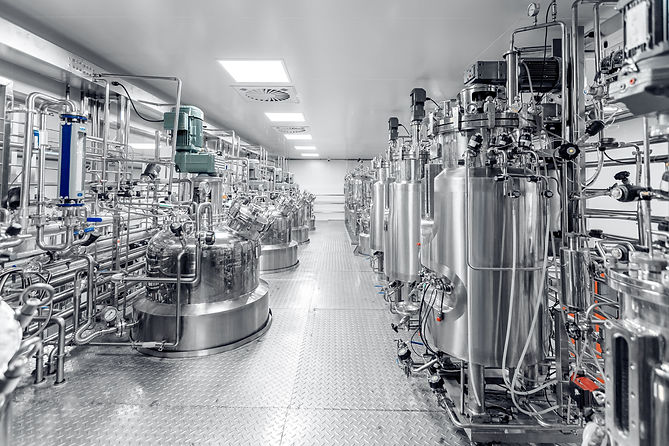
Find the location of a particular element. fan vents on ceiling is located at coordinates (254, 92), (296, 131).